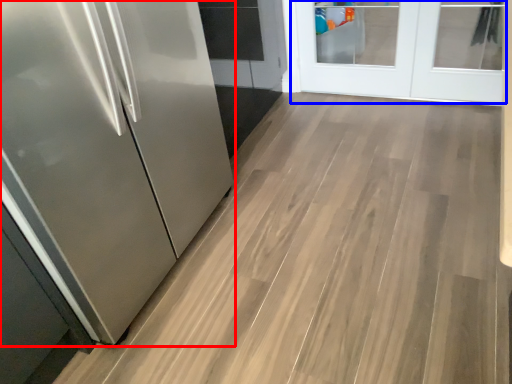
Question: Which point is closer to the camera, refrigerator (highlighted by a red box) or door (highlighted by a blue box)?

Choices:
 (A) refrigerator
 (B) door

Answer: (A)